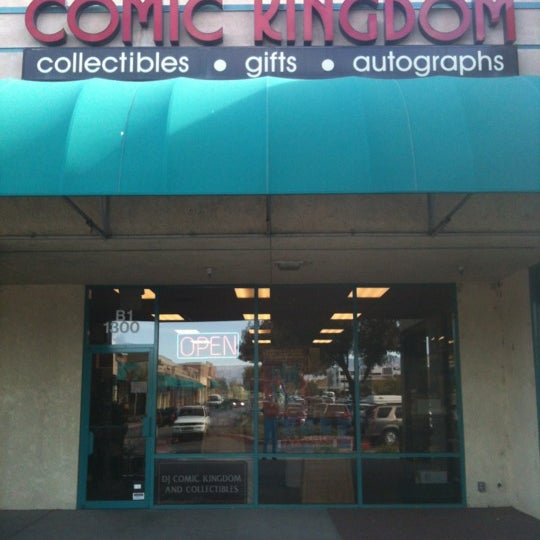
This screenshot has height=540, width=540. In order to click on windows in this screenshot , I will do `click(208, 396)`, `click(320, 386)`, `click(411, 393)`.